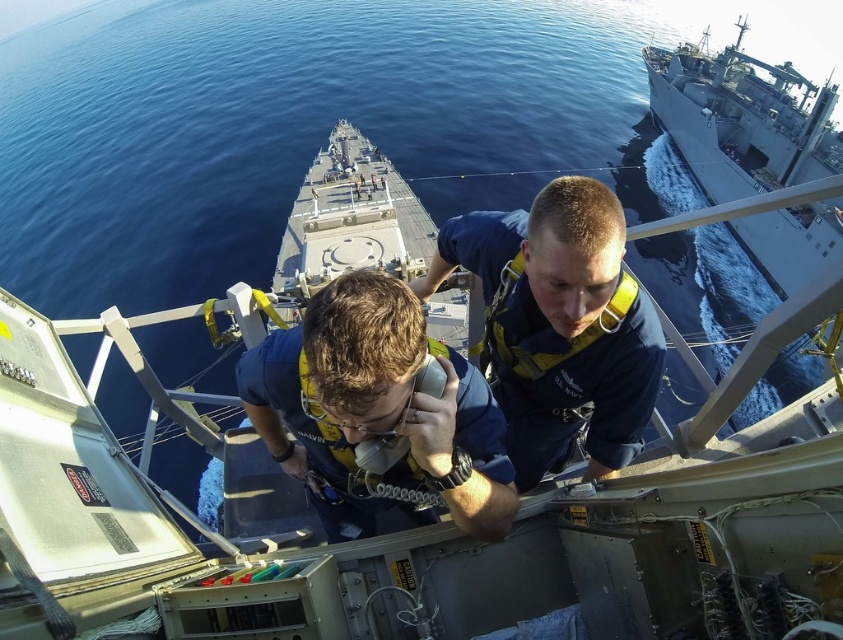
Question: Which point is farther to the camera?

Choices:
 (A) (535, 404)
 (B) (310, 348)

Answer: (A)

Question: Does blue fabric sailor at center appear on the left side of blue fabric uniform at center?

Choices:
 (A) yes
 (B) no

Answer: (B)

Question: Among these objects, which one is farthest from the camera?

Choices:
 (A) blue fabric uniform at center
 (B) blue fabric sailor at center
 (C) gray metallic ship at upper right

Answer: (B)

Question: Does blue fabric sailor at center lie in front of gray metallic ship at upper right?

Choices:
 (A) no
 (B) yes

Answer: (A)

Question: Which point appears closest to the camera in this image?

Choices:
 (A) 527,474
 (B) 729,51

Answer: (A)

Question: Is blue fabric sailor at center bigger than blue fabric uniform at center?

Choices:
 (A) no
 (B) yes

Answer: (B)